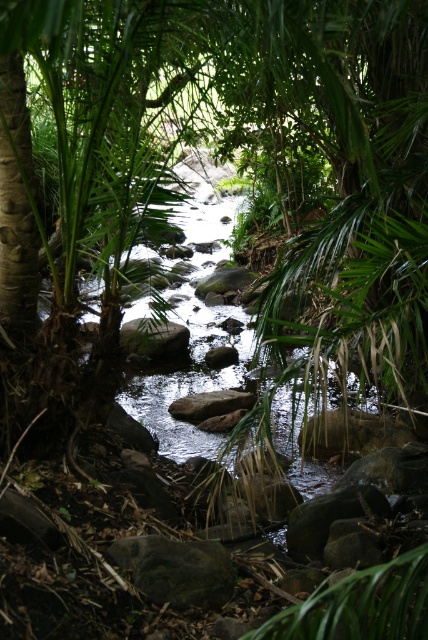
Question: Which point is closer to the camera?

Choices:
 (A) (175, 406)
 (B) (136, 563)

Answer: (B)

Question: Can you confirm if dark gray rock at center is bigger than gray smooth rock at center?

Choices:
 (A) yes
 (B) no

Answer: (B)

Question: Which point appears closest to the camera in this image?

Choices:
 (A) (198, 401)
 (B) (181, 576)

Answer: (B)

Question: Can you confirm if dark gray rock at center is smaller than gray smooth rock at center?

Choices:
 (A) yes
 (B) no

Answer: (A)

Question: Is dark gray rock at center closer to camera compared to gray smooth rock at center?

Choices:
 (A) no
 (B) yes

Answer: (B)